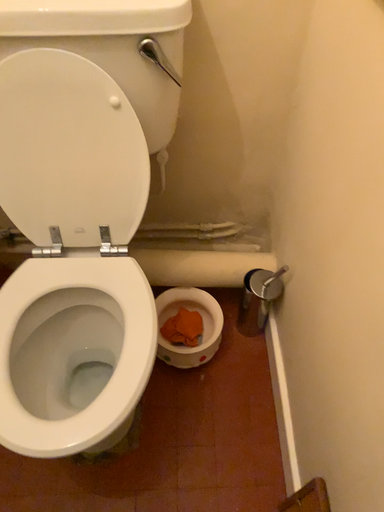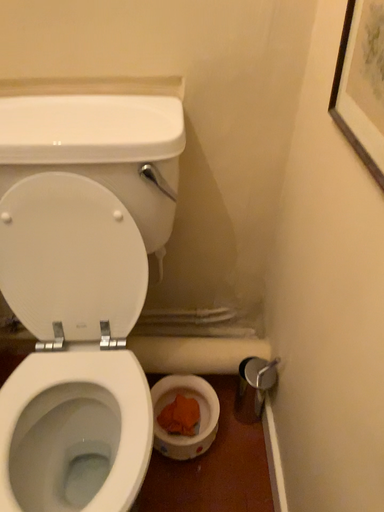
Question: How did the camera likely rotate when shooting the video?

Choices:
 (A) rotated upward
 (B) rotated downward

Answer: (A)